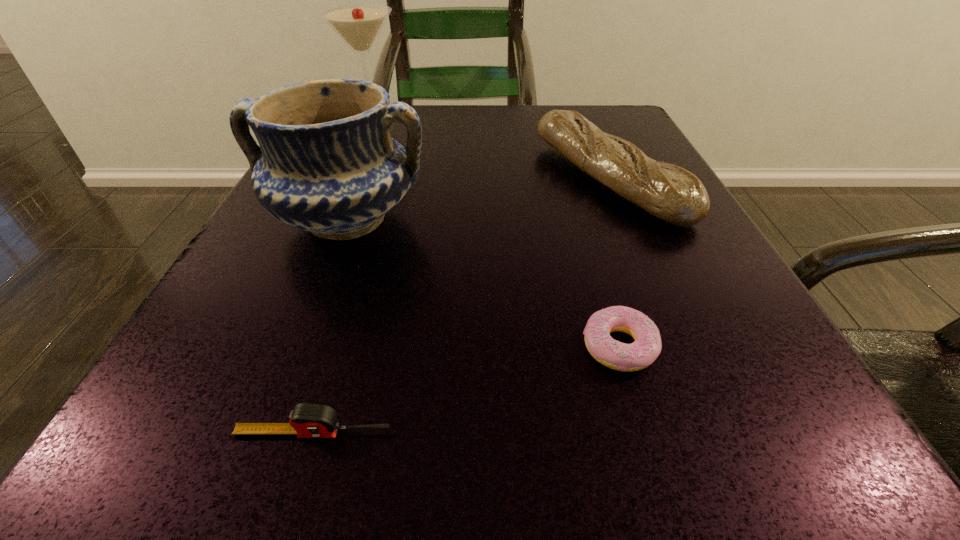
The image size is (960, 540). I want to click on martini, so click(x=359, y=24).

I want to click on the fourth shortest object, so click(327, 164).

Where is `baguet`? baguet is located at coordinates (674, 195).

Locate an element on the screen. This screenshot has width=960, height=540. tape measure is located at coordinates (307, 420).

You are a GUI agent. You are given a task and a screenshot of the screen. Output one action in this format:
    pyautogui.click(x=<x>, y=<y>)
    Task: Click on the fourth tallest object
    This screenshot has width=960, height=540.
    Given the screenshot: What is the action you would take?
    pyautogui.click(x=307, y=420)

Where is `the second nearest object`? The width and height of the screenshot is (960, 540). the second nearest object is located at coordinates (647, 345).

Identify the location of doughnut. Image resolution: width=960 pixels, height=540 pixels. (647, 345).

Find the location of `free space located on the front of the farthest object`. free space located on the front of the farthest object is located at coordinates (347, 175).

Identify the location of free space located 0.290m on the right of the fourth shortest object. This screenshot has width=960, height=540. (621, 219).

You are a GUI agent. You are given a task and a screenshot of the screen. Output one action in this format:
    pyautogui.click(x=<x>, y=<y>)
    Task: Click on the vacant space located on the front of the baguet
    
    Given the screenshot: What is the action you would take?
    pyautogui.click(x=705, y=404)